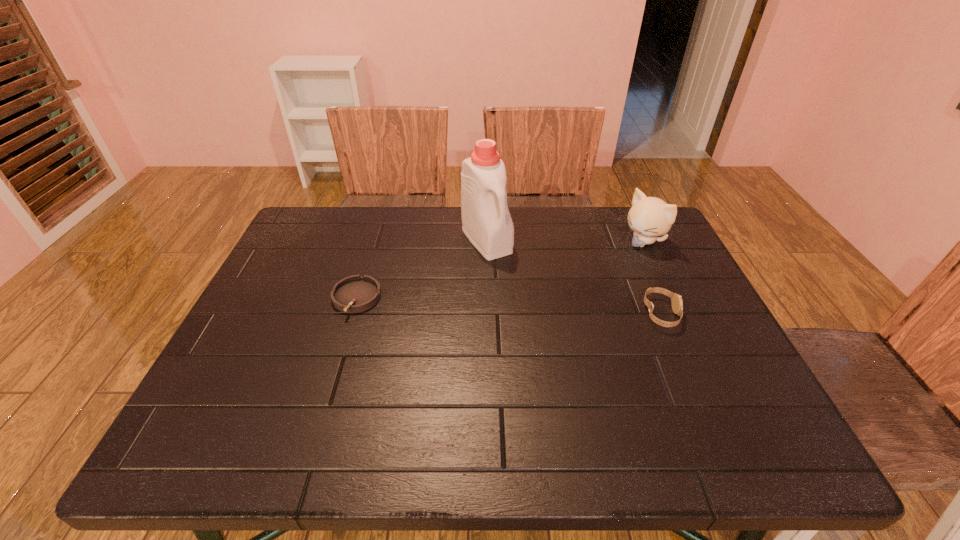
You are a GUI agent. You are given a task and a screenshot of the screen. Output one action in this format:
    pyautogui.click(x=<x>, y=<y>)
    Task: Click on the free space on the desktop that is between the leftmost object and the third tallest object and is positioned on the handle side of the tallest object
    Image resolution: width=960 pixels, height=540 pixels.
    Given the screenshot: What is the action you would take?
    pyautogui.click(x=541, y=308)

Identify the location of vacant spot on the desktop that is between the leftmost object and the third tallest object and is positioned on the face of the third shortest object. The height and width of the screenshot is (540, 960). (546, 308).